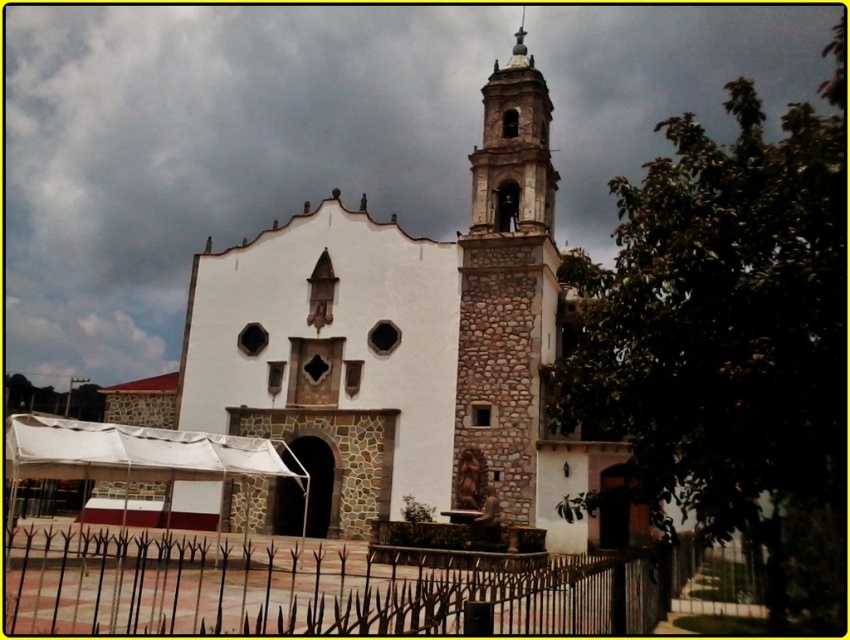
From the picture: You are a visitor approaching the church and notice the black wrought iron fence at lower center and the stone textured tower at center. Which structure appears larger from your perspective?

The stone textured tower at center appears larger than the black wrought iron fence at lower center because the fence is smaller according to the description.

You are standing in front of the church and want to walk towards the two points marked in the image. Which point, point (148,616) or point (474,307), will you reach first?

Point (148,616) is closer to the viewer than point (474,307), so you will reach point (148,616) first.

You are a visitor standing in front of the church. You notice the black wrought iron fence at lower center and the stone textured tower at center. Which object is taller?

The stone textured tower at center is taller than the black wrought iron fence at lower center.